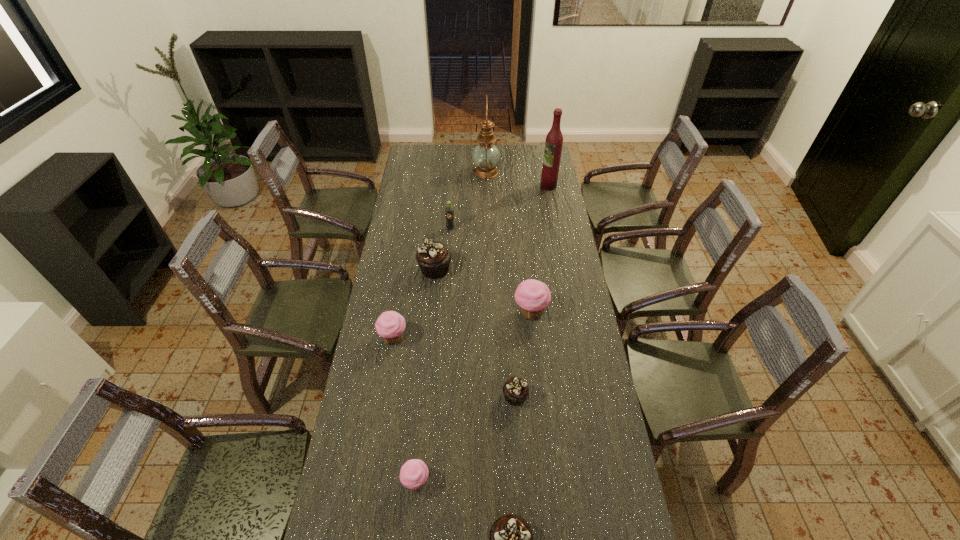
At what (x,y) coordinates should I click in order to perform the action: click on liquor. Please return your answer as a coordinate pair (x, y). The image size is (960, 540). Looking at the image, I should click on (554, 140).

Locate an element on the screen. The height and width of the screenshot is (540, 960). dark liquor is located at coordinates (554, 140).

The image size is (960, 540). Find the location of `oil lamp`. oil lamp is located at coordinates (485, 155).

The image size is (960, 540). What are the coordinates of `green soda` in the screenshot? It's located at (449, 210).

Where is `soda`? soda is located at coordinates (449, 210).

Identify the location of the leftmost brown cupcake. (433, 257).

This screenshot has height=540, width=960. I want to click on the farthest brown cupcake, so click(x=433, y=257).

The width and height of the screenshot is (960, 540). Find the location of `the rightmost pink cupcake`. the rightmost pink cupcake is located at coordinates (533, 296).

You are a GUI agent. You are given a task and a screenshot of the screen. Output one action in this format:
    pyautogui.click(x=<x>, y=<y>)
    Task: Click on the fifth nearest object
    The image size is (960, 540).
    Given the screenshot: What is the action you would take?
    pyautogui.click(x=533, y=296)

Identify the location of the second nearest pink cupcake. Image resolution: width=960 pixels, height=540 pixels. (390, 325).